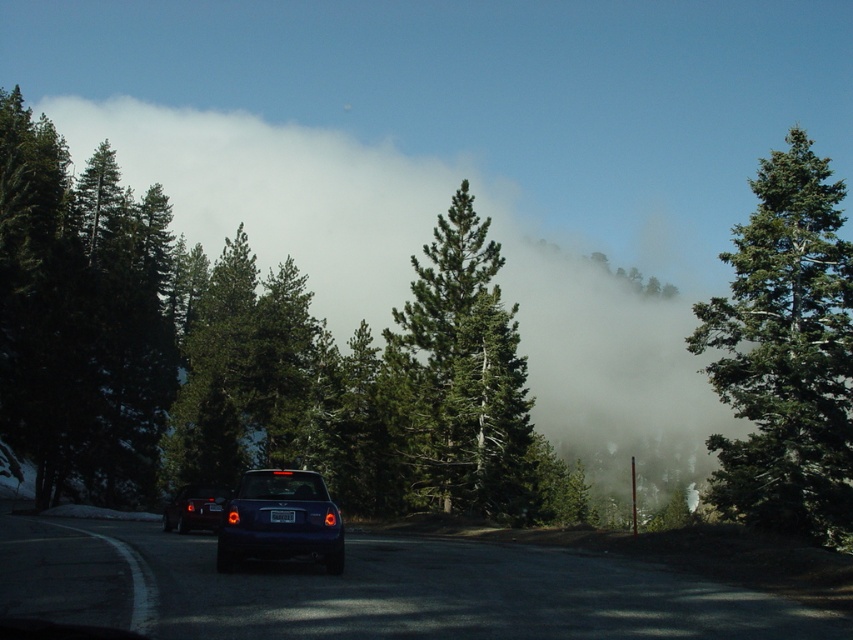
Is white foggy cloud at upper center taller than green textured pine tree at center?

Yes, white foggy cloud at upper center is taller than green textured pine tree at center.

Is point (347, 241) closer to viewer compared to point (468, 278)?

No, it is not.

Locate an element on the screen. Image resolution: width=853 pixels, height=640 pixels. white foggy cloud at upper center is located at coordinates (315, 323).

Can you confirm if green matte tree at right is shorter than black plastic license plate at center?

No.

Who is more distant from viewer, (x=759, y=180) or (x=292, y=513)?

Positioned behind is point (x=759, y=180).

The height and width of the screenshot is (640, 853). I want to click on green matte tree at right, so click(x=785, y=355).

Between green textured pine tree at center and glossy blue car at center, which one appears on the left side from the viewer's perspective?

Positioned to the left is glossy blue car at center.

Can you confirm if green textured pine tree at center is shorter than glossy blue car at center?

Incorrect, green textured pine tree at center's height does not fall short of glossy blue car at center's.

Is point (398, 344) positioned after point (300, 513)?

Yes, it is behind point (300, 513).

This screenshot has height=640, width=853. What are the coordinates of `green textured pine tree at center` in the screenshot? It's located at (461, 372).